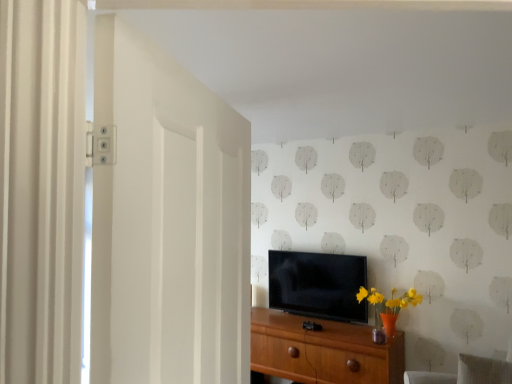
Measure the distance between point (251,314) and camera.

1.41 meters.

You are a GUI agent. You are given a task and a screenshot of the screen. Output one action in this format:
    pyautogui.click(x=<x>, y=<y>)
    Task: Click on the white matte door at left
    The height and width of the screenshot is (384, 512).
    Given the screenshot: What is the action you would take?
    pyautogui.click(x=167, y=222)

From the image's perspective, between gray fabric swivel chair at lower right and wooden chest of drawers at center, which one is located above?

gray fabric swivel chair at lower right.

From the picture: Can you see gray fabric swivel chair at lower right touching wooden chest of drawers at center?

gray fabric swivel chair at lower right is not next to wooden chest of drawers at center, and they're not touching.

Is gray fabric swivel chair at lower right positioned before wooden chest of drawers at center?

That is True.

From a real-world perspective, is gray fabric swivel chair at lower right physically below wooden chest of drawers at center?

Incorrect, from a real-world perspective, gray fabric swivel chair at lower right is higher than wooden chest of drawers at center.

Which of these two, gray fabric swivel chair at lower right or white matte door at left, stands shorter?

With less height is gray fabric swivel chair at lower right.

From a real-world perspective, between gray fabric swivel chair at lower right and white matte door at left, who is vertically higher?

From a 3D spatial view, white matte door at left is above.

Does gray fabric swivel chair at lower right turn towards white matte door at left?

No, gray fabric swivel chair at lower right is not turned towards white matte door at left.

Considering the points (320, 298) and (506, 370), which point is behind, point (320, 298) or point (506, 370)?

Positioned behind is point (320, 298).

Can you confirm if black glossy tv at center is bigger than gray fabric swivel chair at lower right?

Indeed, black glossy tv at center has a larger size compared to gray fabric swivel chair at lower right.

From the image's perspective, is black glossy tv at center under gray fabric swivel chair at lower right?

Incorrect, from the image's perspective, black glossy tv at center is higher than gray fabric swivel chair at lower right.

Is wooden chest of drawers at center next to black glossy tv at center and touching it?

wooden chest of drawers at center and black glossy tv at center are clearly separated.

From the image's perspective, is wooden chest of drawers at center above or below black glossy tv at center?

From the image's perspective, wooden chest of drawers at center appears below black glossy tv at center.

Is wooden chest of drawers at center oriented away from black glossy tv at center?

No.

How far apart are wooden chest of drawers at center and black glossy tv at center?

wooden chest of drawers at center and black glossy tv at center are 15.11 inches apart.

Does gray fabric swivel chair at lower right come in front of black glossy tv at center?

That is True.

From a real-world perspective, who is located lower, gray fabric swivel chair at lower right or black glossy tv at center?

From a 3D spatial view, gray fabric swivel chair at lower right is below.

Based on the photo, can you confirm if gray fabric swivel chair at lower right is bigger than black glossy tv at center?

Incorrect, gray fabric swivel chair at lower right is not larger than black glossy tv at center.

Is gray fabric swivel chair at lower right spatially inside black glossy tv at center, or outside of it?

gray fabric swivel chair at lower right lies outside black glossy tv at center.

From the picture: From the image's perspective, who appears lower, white matte door at left or wooden chest of drawers at center?

wooden chest of drawers at center.

Are white matte door at left and wooden chest of drawers at center beside each other?

There is a gap between white matte door at left and wooden chest of drawers at center.

Which of these two, white matte door at left or wooden chest of drawers at center, stands shorter?

wooden chest of drawers at center is shorter.

Is wooden chest of drawers at center beside gray fabric swivel chair at lower right?

No, wooden chest of drawers at center is not in contact with gray fabric swivel chair at lower right.

From a real-world perspective, is wooden chest of drawers at center physically above gray fabric swivel chair at lower right?

No, from a real-world perspective, wooden chest of drawers at center is not on top of gray fabric swivel chair at lower right.

Does wooden chest of drawers at center have a larger size compared to gray fabric swivel chair at lower right?

Correct, wooden chest of drawers at center is larger in size than gray fabric swivel chair at lower right.

Find the location of a particular element. This screenshot has height=384, width=512. the chest of drawers lying below the gray fabric swivel chair at lower right (from the image's perspective) is located at coordinates (322, 350).

Locate an element on the screen. This screenshot has width=512, height=384. door positioned vertically above the gray fabric swivel chair at lower right (from a real-world perspective) is located at coordinates (167, 222).

Which object lies further to the anchor point wooden chest of drawers at center, white matte door at left or black glossy tv at center?

Based on the image, white matte door at left appears to be further to wooden chest of drawers at center.

Looking at the image, which one is located closer to black glossy tv at center, white matte door at left or gray fabric swivel chair at lower right?

Based on the image, gray fabric swivel chair at lower right appears to be nearer to black glossy tv at center.

Looking at the image, which one is located closer to wooden chest of drawers at center, gray fabric swivel chair at lower right or white matte door at left?

gray fabric swivel chair at lower right is positioned closer to the anchor wooden chest of drawers at center.

Which object lies further to the anchor point gray fabric swivel chair at lower right, white matte door at left or black glossy tv at center?

white matte door at left.

Based on their spatial positions, is gray fabric swivel chair at lower right or wooden chest of drawers at center further from white matte door at left?

Based on the image, wooden chest of drawers at center appears to be further to white matte door at left.

Which object lies nearer to the anchor point gray fabric swivel chair at lower right, wooden chest of drawers at center or black glossy tv at center?

wooden chest of drawers at center is positioned closer to the anchor gray fabric swivel chair at lower right.

Looking at the image, which one is located further to gray fabric swivel chair at lower right, wooden chest of drawers at center or white matte door at left?

white matte door at left is positioned further to the anchor gray fabric swivel chair at lower right.

Looking at the image, which one is located further to black glossy tv at center, white matte door at left or wooden chest of drawers at center?

white matte door at left.

This screenshot has width=512, height=384. I want to click on television between wooden chest of drawers at center and gray fabric swivel chair at lower right from left to right, so (x=318, y=285).

This screenshot has height=384, width=512. I want to click on swivel chair between white matte door at left and wooden chest of drawers at center in the front-back direction, so click(468, 372).

Where is `chest of drawers between white matte door at left and black glossy tv at center from front to back`? This screenshot has width=512, height=384. chest of drawers between white matte door at left and black glossy tv at center from front to back is located at coordinates (322, 350).

Identify the location of swivel chair located between white matte door at left and black glossy tv at center in the depth direction. (468, 372).